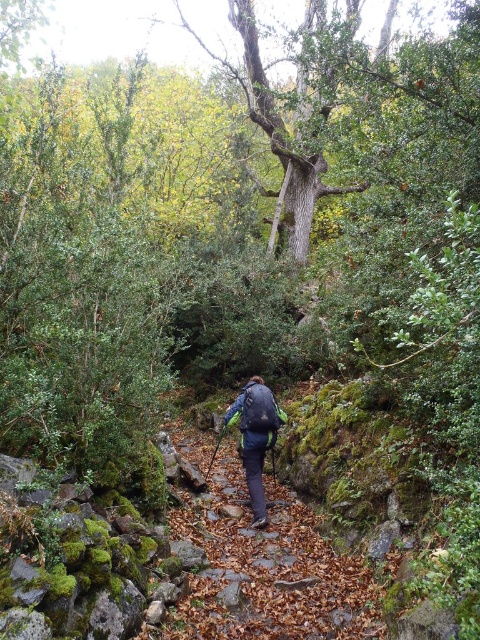
Does point (268, 632) come in front of point (264, 410)?

That is True.

Does brown leafy trail at center have a smaller size compared to matte blue backpack at center?

No, brown leafy trail at center is not smaller than matte blue backpack at center.

Does point (204, 513) come in front of point (262, 428)?

Yes, point (204, 513) is in front of point (262, 428).

Image resolution: width=480 pixels, height=640 pixels. Identify the location of brown leafy trail at center. (264, 568).

Looking at this image, does green fabric backpack at center appear over matte blue backpack at center?

Incorrect, green fabric backpack at center is not positioned above matte blue backpack at center.

Is green fabric backpack at center below matte blue backpack at center?

Indeed, green fabric backpack at center is positioned under matte blue backpack at center.

Between point (259, 468) and point (256, 394), which one is positioned behind?

Positioned behind is point (259, 468).

At what (x,y) coordinates should I click in order to perform the action: click on green fabric backpack at center. Please return your answer as a coordinate pair (x, y). Image resolution: width=480 pixels, height=640 pixels. Looking at the image, I should click on (255, 436).

What do you see at coordinates (264, 568) in the screenshot? I see `brown leafy trail at center` at bounding box center [264, 568].

Where is `brown leafy trail at center`? The image size is (480, 640). brown leafy trail at center is located at coordinates (264, 568).

Which is behind, point (307, 554) or point (260, 528)?

The point (260, 528) is behind.

Identify the location of brown leafy trail at center. (264, 568).